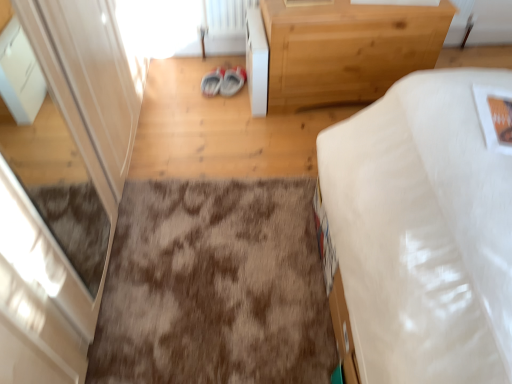
Find the location of `free space between white glossy cabinet at upper center and brown shaggy rug at center`. free space between white glossy cabinet at upper center and brown shaggy rug at center is located at coordinates (223, 139).